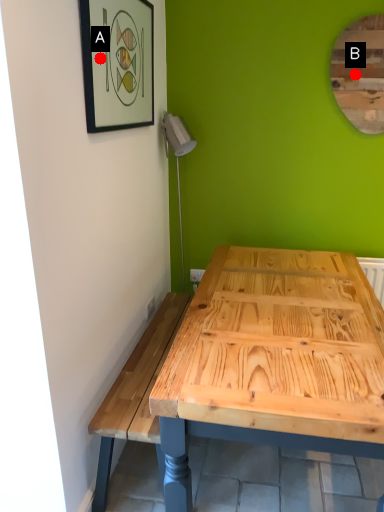
Question: Two points are circled on the image, labeled by A and B beside each circle. Which point appears closest to the camera in this image?

Choices:
 (A) A is closer
 (B) B is closer

Answer: (A)